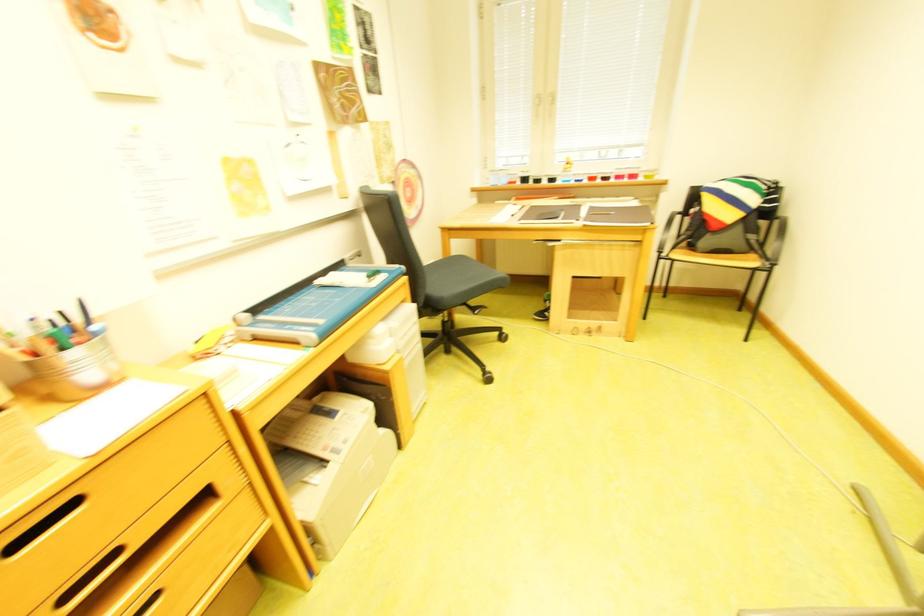
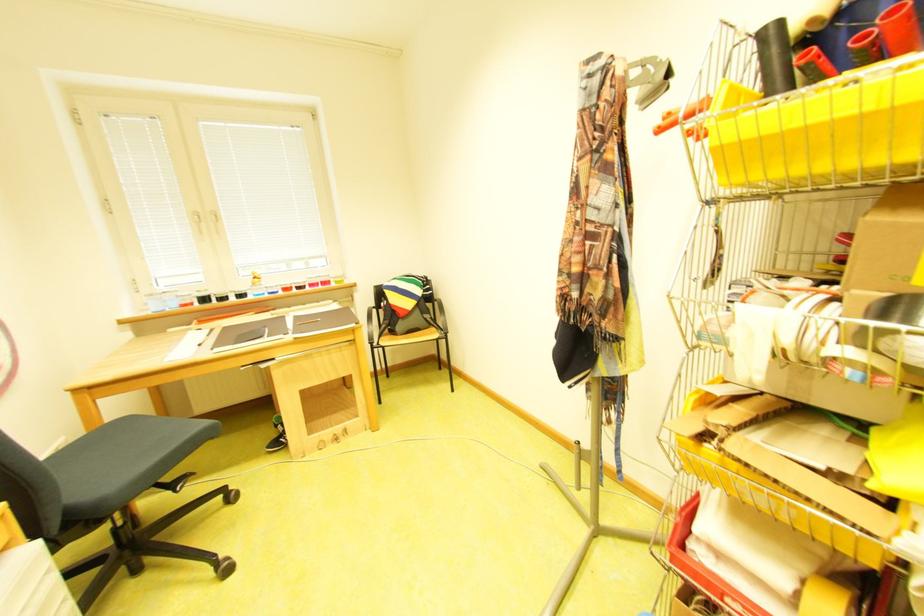
Find the pixel in the second image that matches point 675,256 in the first image.

(385, 345)